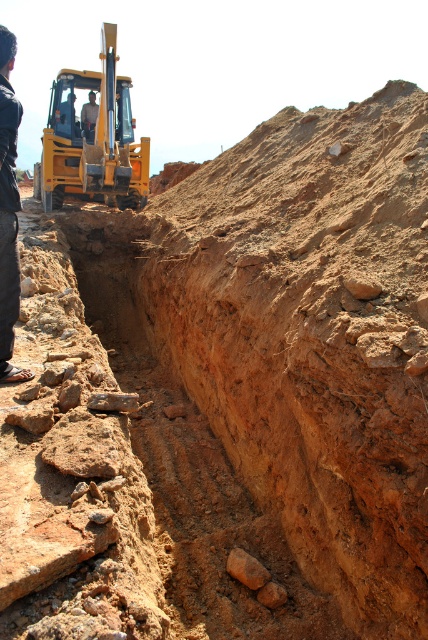
Based on the photo, can you confirm if yellow metallic excavator at upper left is shorter than dark blue shirt at left?

No, yellow metallic excavator at upper left is not shorter than dark blue shirt at left.

Does yellow metallic excavator at upper left lie behind dark blue shirt at left?

Yes, it is behind dark blue shirt at left.

Does point (44, 189) lie in front of point (11, 147)?

No.

You are a GUI agent. You are given a task and a screenshot of the screen. Output one action in this format:
    pyautogui.click(x=<x>, y=<y>)
    Task: Click on the yellow metallic excavator at upper left
    Image resolution: width=428 pixels, height=640 pixels.
    Given the screenshot: What is the action you would take?
    pyautogui.click(x=92, y=140)

Is the position of yellow metallic excavator at upper left less distant than that of brown rough rock at center?

No, yellow metallic excavator at upper left is behind brown rough rock at center.

Can you confirm if yellow metallic excavator at upper left is wider than brown rough rock at center?

Yes, yellow metallic excavator at upper left is wider than brown rough rock at center.

Which is behind, point (116, 204) or point (244, 557)?

The point (116, 204) is more distant.

Where is `yellow metallic excavator at upper left`? This screenshot has width=428, height=640. yellow metallic excavator at upper left is located at coordinates (92, 140).

Is point (11, 284) farther from camera compared to point (252, 572)?

No, it is not.

Between dark blue shirt at left and brown rough rock at center, which one appears on the right side from the viewer's perspective?

Positioned to the right is brown rough rock at center.

Measure the distance between dark blue shirt at left and camera.

They are 3.10 meters apart.

Locate an element on the screen. This screenshot has width=428, height=640. dark blue shirt at left is located at coordinates (8, 211).